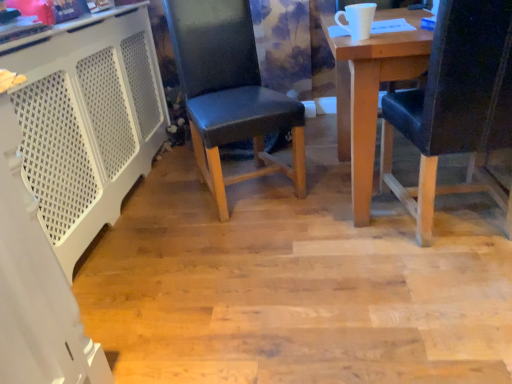
In order to face black leather chair at right, the 1th chair in the right-to-left sequence, should I rotate leftwards or rightwards?

To face it directly, rotate right by 26.462 degrees.

The image size is (512, 384). What do you see at coordinates (456, 107) in the screenshot?
I see `black leather chair at right, which is counted as the 2th chair, starting from the left` at bounding box center [456, 107].

Find the location of a particular element. This screenshot has height=384, width=512. white perforated plastic at left is located at coordinates (87, 120).

Is white perforated plastic at left in contact with black leather chair at right, the 1th chair in the right-to-left sequence?

No, white perforated plastic at left is not making contact with black leather chair at right, the 1th chair in the right-to-left sequence.

This screenshot has height=384, width=512. What are the coordinates of `chair below the white perforated plastic at left (from the image's perspective)` in the screenshot? It's located at (456, 107).

From a real-world perspective, which is physically above, white perforated plastic at left or black leather chair at right, which is counted as the 2th chair, starting from the left?

black leather chair at right, which is counted as the 2th chair, starting from the left, is physically above.

Consider the image. Considering the sizes of objects white perforated plastic at left and black leather chair at right, the 1th chair in the right-to-left sequence, in the image provided, who is wider, white perforated plastic at left or black leather chair at right, the 1th chair in the right-to-left sequence,?

Wider between the two is black leather chair at right, the 1th chair in the right-to-left sequence.

Considering the sizes of black leather chair at right, which is counted as the 2th chair, starting from the left, and black leather chair at center, placed as the 1th chair when sorted from left to right, in the image, is black leather chair at right, which is counted as the 2th chair, starting from the left, taller or shorter than black leather chair at center, placed as the 1th chair when sorted from left to right,?

In the image, black leather chair at right, which is counted as the 2th chair, starting from the left, appears to be shorter than black leather chair at center, placed as the 1th chair when sorted from left to right.

You are a GUI agent. You are given a task and a screenshot of the screen. Output one action in this format:
    pyautogui.click(x=<x>, y=<y>)
    Task: Click on the chair that is below the black leather chair at center, placed as the 1th chair when sorted from left to right (from the image's perspective)
    
    Given the screenshot: What is the action you would take?
    pyautogui.click(x=456, y=107)

Consider the image. Is black leather chair at right, the 1th chair in the right-to-left sequence, in front of or behind black leather chair at center, placed as the 1th chair when sorted from left to right, in the image?

In the image, black leather chair at right, the 1th chair in the right-to-left sequence, appears in front of black leather chair at center, placed as the 1th chair when sorted from left to right.

Is black leather chair at right, the 1th chair in the right-to-left sequence, spatially inside black leather chair at center, placed as the 1th chair when sorted from left to right, or outside of it?

black leather chair at right, the 1th chair in the right-to-left sequence, exists outside the volume of black leather chair at center, placed as the 1th chair when sorted from left to right.

From the picture: Which object is closer to the camera taking this photo, black leather chair at center, marked as the second chair in a right-to-left arrangement, or black leather chair at right, the 1th chair in the right-to-left sequence?

black leather chair at right, the 1th chair in the right-to-left sequence, is in front.

From a real-world perspective, is black leather chair at center, placed as the 1th chair when sorted from left to right, below black leather chair at right, the 1th chair in the right-to-left sequence?

No, from a real-world perspective, black leather chair at center, placed as the 1th chair when sorted from left to right, is not beneath black leather chair at right, the 1th chair in the right-to-left sequence.

Could you tell me if black leather chair at center, placed as the 1th chair when sorted from left to right, is turned towards black leather chair at right, which is counted as the 2th chair, starting from the left?

No, black leather chair at center, placed as the 1th chair when sorted from left to right, is not aimed at black leather chair at right, which is counted as the 2th chair, starting from the left.

How many degrees apart are the facing directions of black leather chair at right, the 1th chair in the right-to-left sequence, and white perforated plastic at left?

The facing directions of black leather chair at right, the 1th chair in the right-to-left sequence, and white perforated plastic at left are 95.5 degrees apart.

Would you say black leather chair at right, the 1th chair in the right-to-left sequence, contains white perforated plastic at left?

No.

Does point (465, 136) come behind point (126, 104)?

No, it is in front of (126, 104).

From a real-world perspective, is black leather chair at right, the 1th chair in the right-to-left sequence, located higher than white perforated plastic at left?

Correct, in the physical world, black leather chair at right, the 1th chair in the right-to-left sequence, is higher than white perforated plastic at left.

Considering the relative sizes of black leather chair at center, marked as the second chair in a right-to-left arrangement, and white perforated plastic at left in the image provided, is black leather chair at center, marked as the second chair in a right-to-left arrangement, wider than white perforated plastic at left?

Yes, black leather chair at center, marked as the second chair in a right-to-left arrangement, is wider than white perforated plastic at left.

Considering the relative sizes of black leather chair at center, marked as the second chair in a right-to-left arrangement, and white perforated plastic at left in the image provided, is black leather chair at center, marked as the second chair in a right-to-left arrangement, smaller than white perforated plastic at left?

Correct, black leather chair at center, marked as the second chair in a right-to-left arrangement, occupies less space than white perforated plastic at left.

The width and height of the screenshot is (512, 384). What are the coordinates of `chair behind the white perforated plastic at left` in the screenshot? It's located at (229, 92).

From a real-world perspective, is black leather chair at center, marked as the second chair in a right-to-left arrangement, positioned above or below white perforated plastic at left?

Clearly, from a real-world perspective, black leather chair at center, marked as the second chair in a right-to-left arrangement, is above white perforated plastic at left.

From the image's perspective, which one is positioned lower, white perforated plastic at left or black leather chair at center, placed as the 1th chair when sorted from left to right?

white perforated plastic at left is shown below in the image.

From a real-world perspective, which object rests below the other?

white perforated plastic at left.

Between white perforated plastic at left and black leather chair at center, marked as the second chair in a right-to-left arrangement, which one appears on the right side from the viewer's perspective?

From the viewer's perspective, black leather chair at center, marked as the second chair in a right-to-left arrangement, appears more on the right side.

Considering the sizes of white perforated plastic at left and black leather chair at center, placed as the 1th chair when sorted from left to right, in the image, is white perforated plastic at left wider or thinner than black leather chair at center, placed as the 1th chair when sorted from left to right,?

In the image, white perforated plastic at left appears to be more narrow than black leather chair at center, placed as the 1th chair when sorted from left to right.

In the image, there is a white perforated plastic at left. Where is `chair below it (from the image's perspective)`? Image resolution: width=512 pixels, height=384 pixels. chair below it (from the image's perspective) is located at coordinates (456, 107).

Where is `chair located above the black leather chair at right, the 1th chair in the right-to-left sequence (from the image's perspective)`? chair located above the black leather chair at right, the 1th chair in the right-to-left sequence (from the image's perspective) is located at coordinates (229, 92).

Looking at the image, which one is located further to white perforated plastic at left, black leather chair at right, the 1th chair in the right-to-left sequence, or black leather chair at center, placed as the 1th chair when sorted from left to right?

black leather chair at right, the 1th chair in the right-to-left sequence, is further to white perforated plastic at left.

Which object lies nearer to the anchor point black leather chair at center, marked as the second chair in a right-to-left arrangement, black leather chair at right, which is counted as the 2th chair, starting from the left, or white perforated plastic at left?

white perforated plastic at left lies closer to black leather chair at center, marked as the second chair in a right-to-left arrangement, than the other object.

Based on their spatial positions, is white perforated plastic at left or black leather chair at center, placed as the 1th chair when sorted from left to right, closer to black leather chair at right, the 1th chair in the right-to-left sequence?

black leather chair at center, placed as the 1th chair when sorted from left to right.

From the image, which object appears to be farther from black leather chair at center, marked as the second chair in a right-to-left arrangement, white perforated plastic at left or black leather chair at right, the 1th chair in the right-to-left sequence?

black leather chair at right, the 1th chair in the right-to-left sequence, is positioned further to the anchor black leather chair at center, marked as the second chair in a right-to-left arrangement.

Estimate the real-world distances between objects in this image. Which object is further from black leather chair at right, which is counted as the 2th chair, starting from the left, black leather chair at center, placed as the 1th chair when sorted from left to right, or white perforated plastic at left?

The object further to black leather chair at right, which is counted as the 2th chair, starting from the left, is white perforated plastic at left.

When comparing their distances from white perforated plastic at left, does black leather chair at center, placed as the 1th chair when sorted from left to right, or black leather chair at right, the 1th chair in the right-to-left sequence, seem closer?

black leather chair at center, placed as the 1th chair when sorted from left to right.

At what (x,y) coordinates should I click in order to perform the action: click on chair located between white perforated plastic at left and black leather chair at right, the 1th chair in the right-to-left sequence, in the left-right direction. Please return your answer as a coordinate pair (x, y). The image size is (512, 384). Looking at the image, I should click on (229, 92).